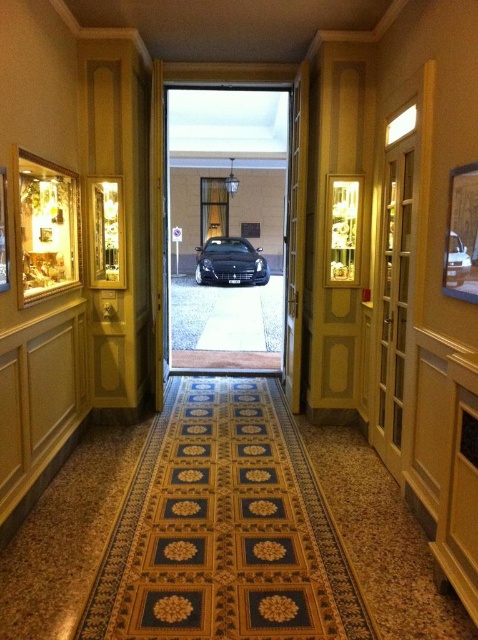
You are standing in the hallway and want to exit to the car outside. Which direction should you move relative to the shiny black car at center to reach the wooden door at right?

You should move to the right of the shiny black car at center to reach the wooden door at right because the wooden door at right is located to the right side of the shiny black car at center.

You are standing in the hallway and want to exit to the car outside. Which object should you pass through first, the wooden door at right or the shiny black car at center?

The wooden door at right is located below the shiny black car at center, so you must pass through the wooden door at right first before reaching the shiny black car at center.

You are standing in the hallway and want to know if the wooden door at right can fit through the space currently occupied by the shiny black car at center. Based on their sizes, is this possible?

The wooden door at right occupies less space than the shiny black car at center, so the wooden door at right can fit through the space currently occupied by the shiny black car at center because it is smaller in size.